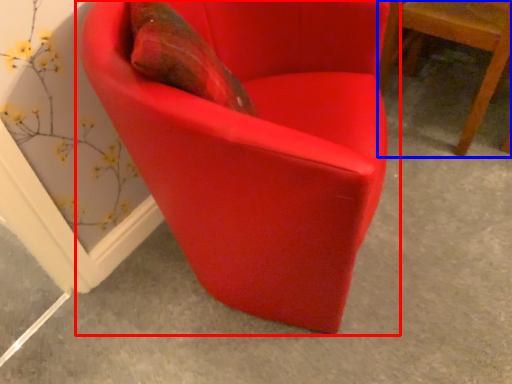
Question: Which object is further to the camera taking this photo, chair (highlighted by a red box) or chair (highlighted by a blue box)?

Choices:
 (A) chair
 (B) chair

Answer: (B)